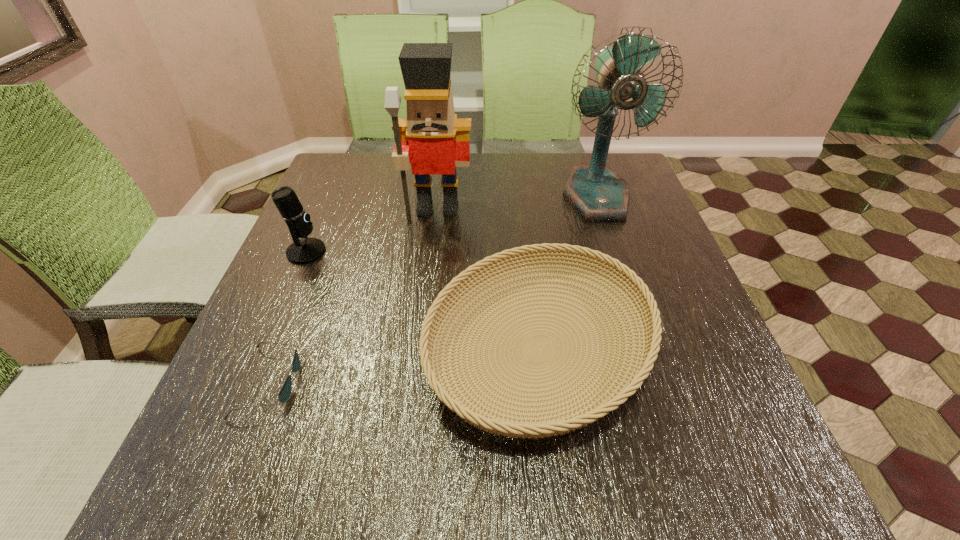
At what (x,y) coordinates should I click in order to perform the action: click on free space at the far edge of the desktop. Please return your answer as a coordinate pair (x, y). Looking at the image, I should click on (518, 156).

The width and height of the screenshot is (960, 540). I want to click on vacant area at the near edge, so click(x=455, y=495).

This screenshot has width=960, height=540. In order to click on vacant position at the left edge of the desktop in this screenshot , I will do `click(335, 303)`.

Identify the location of vacant area at the right edge of the desktop. The height and width of the screenshot is (540, 960). (606, 247).

This screenshot has width=960, height=540. In the image, there is a desktop. In order to click on free space at the far left corner in this screenshot , I will do `click(366, 167)`.

Locate an element on the screen. The height and width of the screenshot is (540, 960). vacant area at the near right corner is located at coordinates (678, 496).

The width and height of the screenshot is (960, 540). I want to click on empty space between the nutcracker and the third tallest object, so click(372, 230).

The width and height of the screenshot is (960, 540). I want to click on vacant area that lies between the third shortest object and the fan, so click(451, 224).

Locate an element on the screen. vacant space that is in between the shortest object and the nutcracker is located at coordinates (353, 295).

Locate an element on the screen. The image size is (960, 540). free spot between the basket and the shortest object is located at coordinates (404, 366).